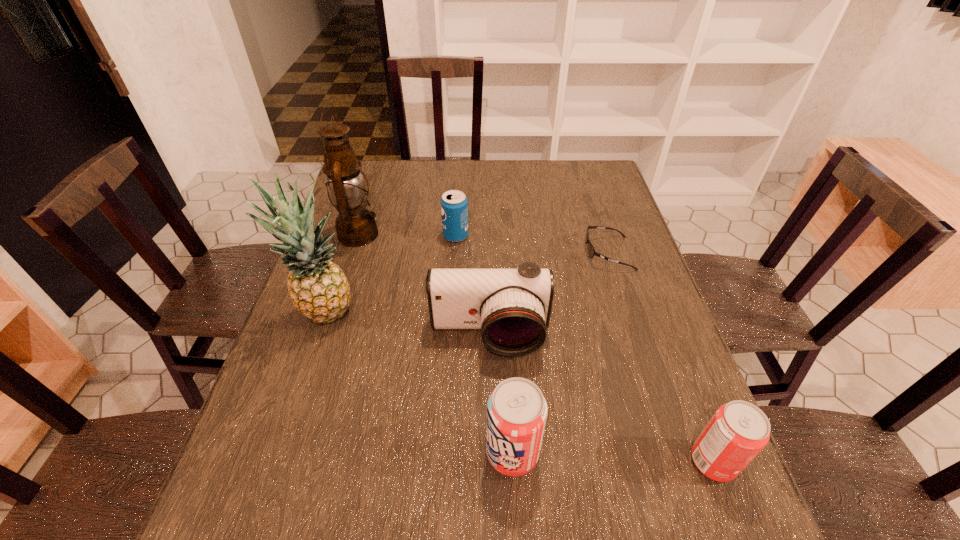
Identify the location of vacant area between the rightmost soda can and the farthest soda can. click(584, 349).

Identify which object is located as the fourth nearest to the shortest object. Please provide its 2D coordinates. Your answer should be formatted as a tuple, i.e. [(x, y)], where the tuple contains the x and y coordinates of a point satisfying the conditions above.

[(516, 410)]

You are a GUI agent. You are given a task and a screenshot of the screen. Output one action in this format:
    pyautogui.click(x=<x>, y=<y>)
    Task: Click on the third closest object to the tallest soda can
    
    Given the screenshot: What is the action you would take?
    pyautogui.click(x=318, y=288)

Identify which soda can is the second nearest to the farthest soda can. Please provide its 2D coordinates. Your answer should be formatted as a tuple, i.e. [(x, y)], where the tuple contains the x and y coordinates of a point satisfying the conditions above.

[(738, 431)]

Identify which soda can is the second nearest to the rightmost soda can. Please provide its 2D coordinates. Your answer should be formatted as a tuple, i.e. [(x, y)], where the tuple contains the x and y coordinates of a point satisfying the conditions above.

[(454, 205)]

At what (x,y) coordinates should I click in order to perform the action: click on vacant space that satisfies the following two spatial constraints: 1. on the surface of the rightmost soda can; 2. on the left side of the camcorder. Please return your answer as a coordinate pair (x, y). This screenshot has height=540, width=960. Looking at the image, I should click on (492, 462).

Locate an element on the screen. free space that satisfies the following two spatial constraints: 1. on the front side of the oil lamp; 2. on the right side of the leftmost soda can is located at coordinates (358, 236).

This screenshot has height=540, width=960. I want to click on vacant region that satisfies the following two spatial constraints: 1. on the front-facing side of the sunglasses; 2. on the back side of the rightmost soda can, so click(675, 462).

This screenshot has width=960, height=540. I want to click on vacant point that satisfies the following two spatial constraints: 1. on the front-facing side of the shortest object; 2. on the surface of the camcorder, so click(635, 336).